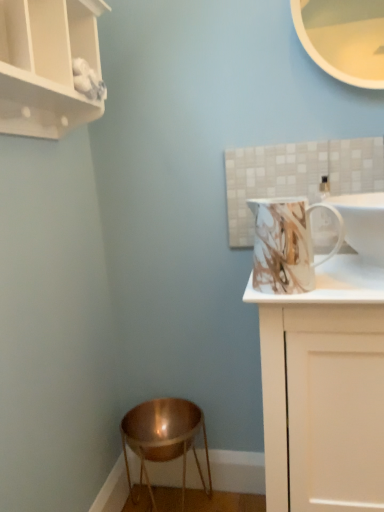
Question: Would you say white matte cupboard at upper left is a long distance from white glossy cabinet at right?

Choices:
 (A) yes
 (B) no

Answer: (B)

Question: Does white matte cupboard at upper left touch white glossy cabinet at right?

Choices:
 (A) yes
 (B) no

Answer: (B)

Question: Does white matte cupboard at upper left have a lesser height compared to white glossy cabinet at right?

Choices:
 (A) no
 (B) yes

Answer: (B)

Question: Is white matte cupboard at upper left turned away from white glossy cabinet at right?

Choices:
 (A) yes
 (B) no

Answer: (B)

Question: Does white matte cupboard at upper left have a greater height compared to white glossy cabinet at right?

Choices:
 (A) no
 (B) yes

Answer: (A)

Question: In terms of height, does copper metallic stool at lower left look taller or shorter compared to white glossy sink at upper right?

Choices:
 (A) tall
 (B) short

Answer: (A)

Question: In the image, is copper metallic stool at lower left positioned in front of or behind white glossy sink at upper right?

Choices:
 (A) behind
 (B) front

Answer: (A)

Question: Is copper metallic stool at lower left situated inside white glossy sink at upper right or outside?

Choices:
 (A) inside
 (B) outside

Answer: (B)

Question: Considering the relative positions of copper metallic stool at lower left and white glossy sink at upper right in the image provided, is copper metallic stool at lower left to the left or to the right of white glossy sink at upper right?

Choices:
 (A) right
 (B) left

Answer: (B)

Question: Is copper metallic stool at lower left bigger or smaller than white glossy cabinet at right?

Choices:
 (A) small
 (B) big

Answer: (A)

Question: From a real-world perspective, relative to white glossy cabinet at right, is copper metallic stool at lower left vertically above or below?

Choices:
 (A) above
 (B) below

Answer: (B)

Question: Relative to white glossy cabinet at right, is copper metallic stool at lower left in front or behind?

Choices:
 (A) behind
 (B) front

Answer: (A)

Question: Would you say copper metallic stool at lower left is inside or outside white glossy cabinet at right?

Choices:
 (A) outside
 (B) inside

Answer: (A)

Question: Visually, is white glossy sink at upper right positioned to the left or to the right of copper metallic stool at lower left?

Choices:
 (A) right
 (B) left

Answer: (A)

Question: Is white glossy sink at upper right in front of or behind copper metallic stool at lower left in the image?

Choices:
 (A) front
 (B) behind

Answer: (A)